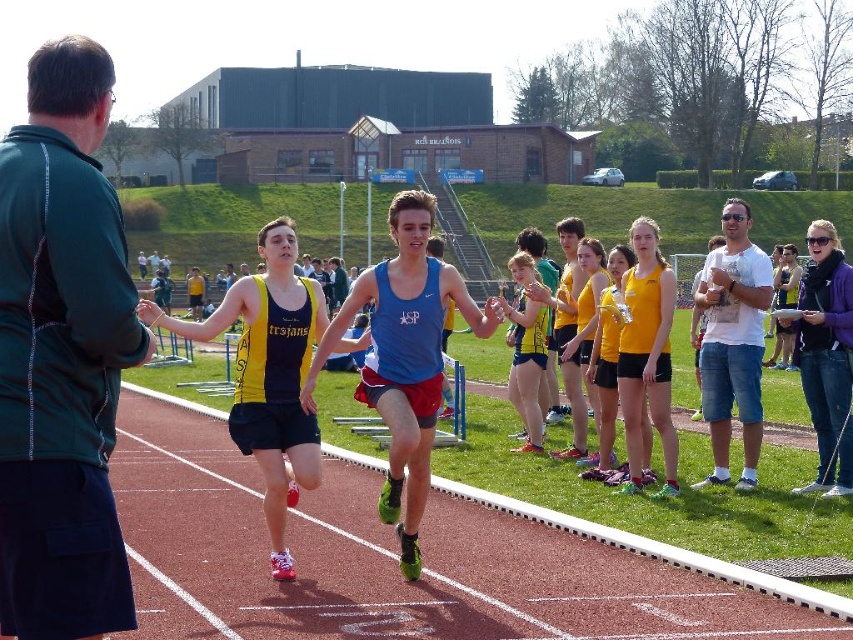
Is blue matte tank top at center behind yellow matte tank top at center?

No, it is in front of yellow matte tank top at center.

Who is more distant from viewer, (339, 323) or (627, 346)?

Point (627, 346)

Between point (370, 273) and point (640, 387), which one is positioned in front?

Positioned in front is point (370, 273).

Identify the location of blue matte tank top at center. (404, 356).

Is point (322, 332) farther from camera compared to point (646, 356)?

That is False.

Can you confirm if matte blue tank top at center is positioned above yellow matte tank top at center?

Incorrect, matte blue tank top at center is not positioned above yellow matte tank top at center.

Is point (256, 433) less distant than point (636, 380)?

Yes, point (256, 433) is closer to viewer.

Locate an element on the screen. This screenshot has width=853, height=640. matte blue tank top at center is located at coordinates (268, 374).

Does yellow matte tank top at center have a smaller size compared to rubberized red track at center?

Correct, yellow matte tank top at center occupies less space than rubberized red track at center.

Who is shorter, yellow matte tank top at center or rubberized red track at center?

Standing shorter between the two is rubberized red track at center.

Does point (634, 480) come farther from viewer compared to point (782, 582)?

Yes, it is.

Find the location of a particular element. This screenshot has height=640, width=853. yellow matte tank top at center is located at coordinates (646, 355).